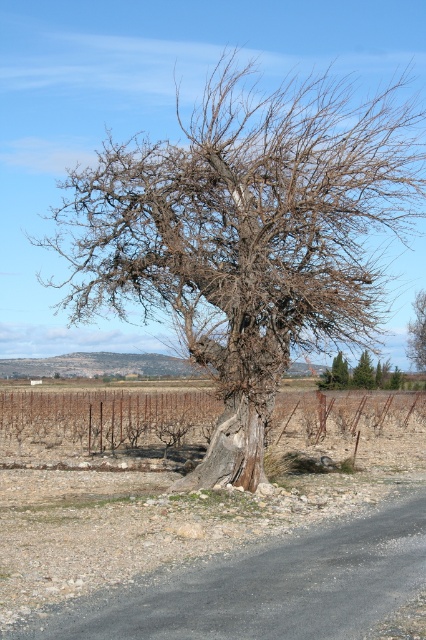
Question: Which point appears closest to the camera in this image?

Choices:
 (A) (414, 324)
 (B) (371, 372)

Answer: (B)

Question: Does green textured pine tree at center come behind bark textured tree at center?

Choices:
 (A) no
 (B) yes

Answer: (A)

Question: Among these points, which one is farthest from the camera?

Choices:
 (A) (362, 368)
 (B) (382, 365)
 (C) (417, 314)

Answer: (C)

Question: Is bark textured tree at center bigger than green matte evergreen tree at center?

Choices:
 (A) no
 (B) yes

Answer: (B)

Question: Among these objects, which one is farthest from the camera?

Choices:
 (A) green textured pine tree at center
 (B) green matte evergreen tree at center

Answer: (B)

Question: Can you confirm if bare wood tree at center is positioned below green matte evergreen tree at center?

Choices:
 (A) no
 (B) yes

Answer: (A)